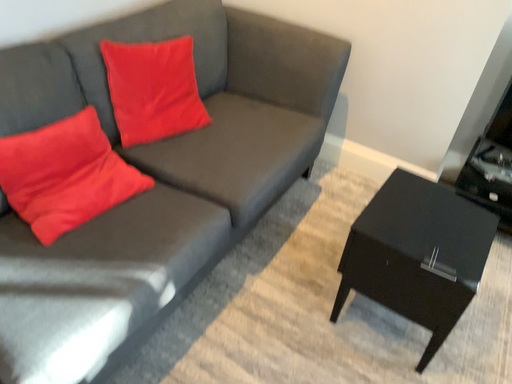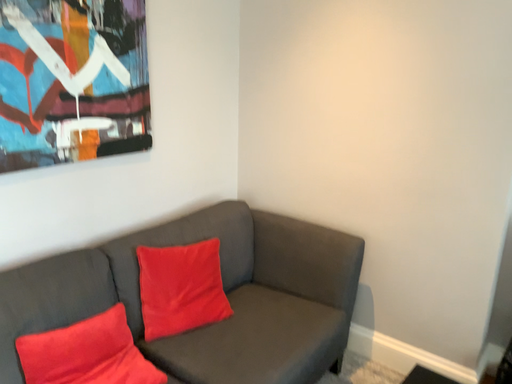
Question: How did the camera likely rotate when shooting the video?

Choices:
 (A) rotated left
 (B) rotated right

Answer: (A)